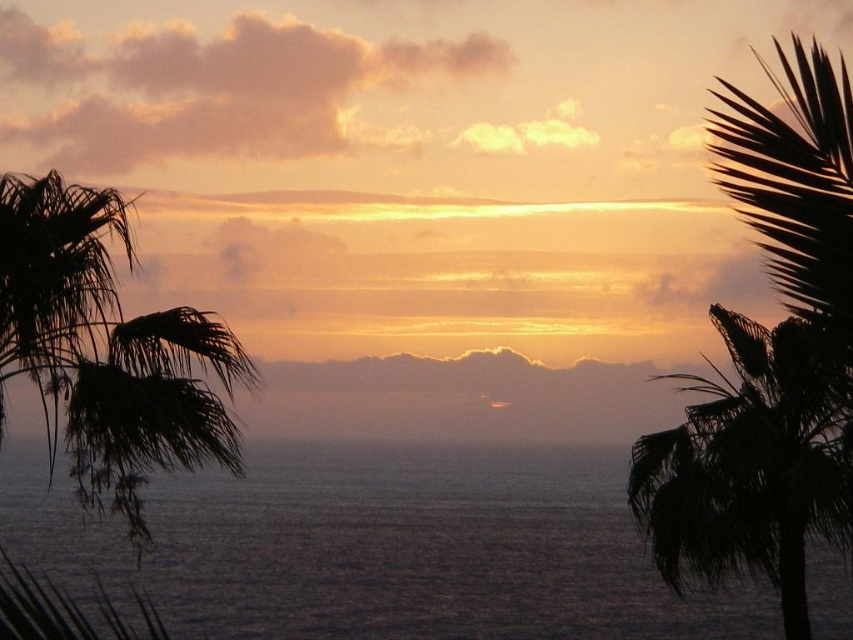
You are a photographer trying to capture the sunset. You notice the silhouette leafy palm at left and the dark gray water at center. Based on their positions, which object would appear closer to you in the photo?

The dark gray water at center appears closer because the silhouette leafy palm at left is positioned behind it, making the water in the center the foreground element.

You are standing on a beach and see the dark gray water at center and the silhouette leafy palm at right. Which object is closer to the left side of your view?

The dark gray water at center is closer to the left side of your view than the silhouette leafy palm at right.